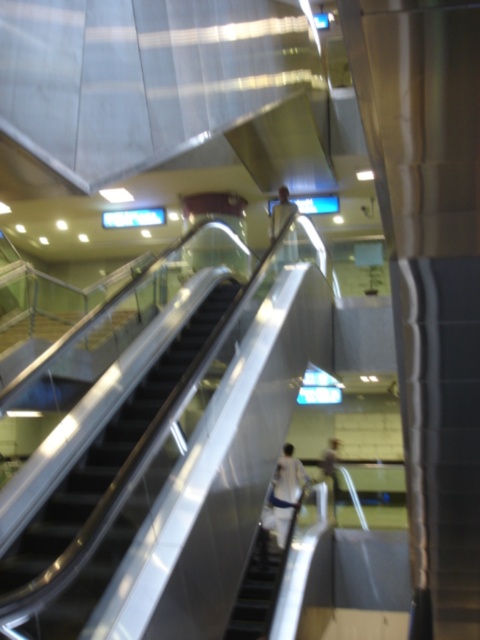
Does point (180, 332) lie behind point (334, 513)?

No.

Does point (134, 442) lie in front of point (336, 467)?

Yes, it is.

You are a GUI agent. You are given a task and a screenshot of the screen. Output one action in this format:
    pyautogui.click(x=<x>, y=<y>)
    Task: Click on the metallic escalator at center
    
    Given the screenshot: What is the action you would take?
    pyautogui.click(x=108, y=451)

Identify the location of metallic escalator at center. This screenshot has height=640, width=480. (108, 451).

Is white fabric at center behind light brown leather jacket at center?

No.

Between white fabric at center and light brown leather jacket at center, which one has more height?

white fabric at center

At what (x,y) coordinates should I click in order to perform the action: click on white fabric at center. Please return your answer as a coordinate pair (x, y). Looking at the image, I should click on (284, 493).

Can you confirm if metallic escalator at center is smaller than white fabric at center?

No, metallic escalator at center is not smaller than white fabric at center.

Does point (87, 486) come behind point (284, 524)?

No.

What do you see at coordinates (108, 451) in the screenshot? I see `metallic escalator at center` at bounding box center [108, 451].

The image size is (480, 640). I want to click on metallic escalator at center, so click(x=108, y=451).